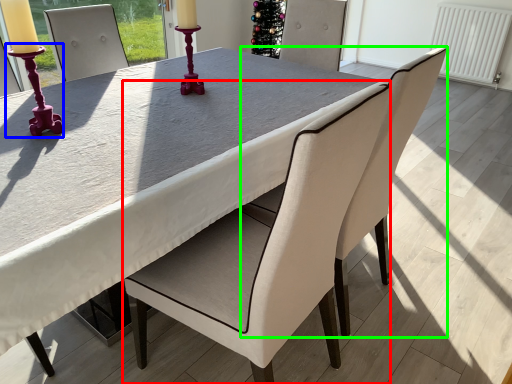
Question: Which object is the farthest from chair (highlighted by a red box)? Choose among these: candle holder (highlighted by a blue box) or chair (highlighted by a green box).

Choices:
 (A) candle holder
 (B) chair

Answer: (A)